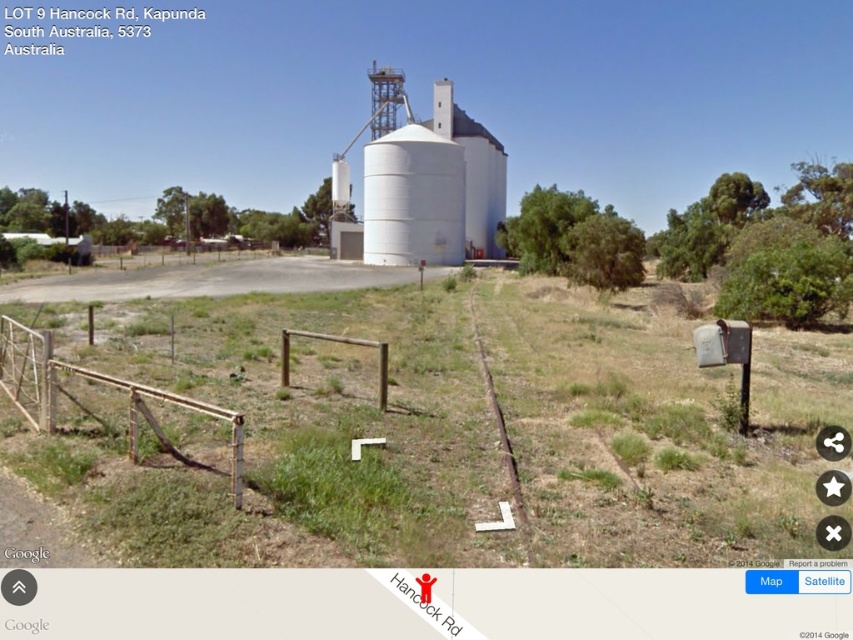
Is point (408, 232) positioned before point (132, 438)?

No.

Which is below, white matte silo at center or brown wooden fence at left?

brown wooden fence at left is lower down.

Is point (405, 188) less distant than point (146, 394)?

No, (405, 188) is further to viewer.

Find the location of a particular element. white matte silo at center is located at coordinates (413, 198).

Is white smooth silo at center above white matte silo at center?

Indeed, white smooth silo at center is positioned over white matte silo at center.

Between point (477, 157) and point (401, 134), which one is positioned in front?

Point (401, 134) is more forward.

The width and height of the screenshot is (853, 640). What are the coordinates of `white smooth silo at center` in the screenshot? It's located at (421, 182).

Does white smooth silo at center appear on the left side of brown wooden fence at left?

Yes, white smooth silo at center is to the left of brown wooden fence at left.

Who is lower down, white smooth silo at center or brown wooden fence at left?

brown wooden fence at left is below.

Which is behind, point (491, 188) or point (47, 355)?

The point (491, 188) is behind.

The width and height of the screenshot is (853, 640). What are the coordinates of `white smooth silo at center` in the screenshot? It's located at (421, 182).